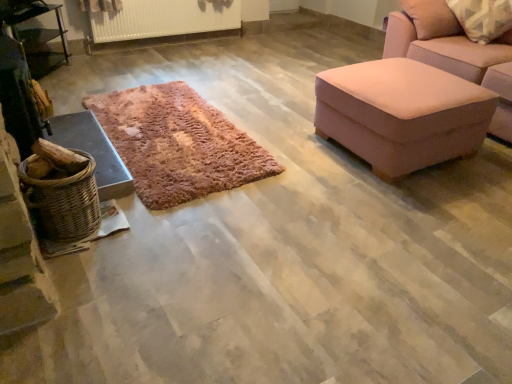
Question: Is metallic silver table at left bigger or smaller than woven wood basket at left?

Choices:
 (A) big
 (B) small

Answer: (A)

Question: In terms of width, does metallic silver table at left look wider or thinner when compared to woven wood basket at left?

Choices:
 (A) wide
 (B) thin

Answer: (B)

Question: Based on their relative distances, which object is nearer to the woven brown basket at left?

Choices:
 (A) woven wood basket at left
 (B) metallic silver table at left

Answer: (A)

Question: Estimate the real-world distances between objects in this image. Which object is farther from the woven wood basket at left?

Choices:
 (A) metallic silver table at left
 (B) woven brown basket at left

Answer: (A)